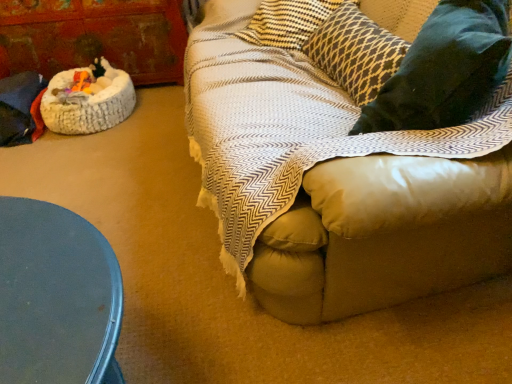
Question: From the image's perspective, relative to white fluffy cat bed at left, is velvety dark green pillow at right above or below?

Choices:
 (A) below
 (B) above

Answer: (A)

Question: Would you say velvety dark green pillow at right is inside or outside white fluffy cat bed at left?

Choices:
 (A) outside
 (B) inside

Answer: (A)

Question: Estimate the real-world distances between objects in this image. Which object is closer to the dark gray textured pillow at upper right?

Choices:
 (A) velvety dark green pillow at right
 (B) white fluffy cat bed at left
 (C) rustic wood armoire at left

Answer: (A)

Question: Which object is the farthest from the white fluffy cat bed at left?

Choices:
 (A) dark gray textured pillow at upper right
 (B) velvety dark green pillow at right
 (C) rustic wood armoire at left

Answer: (B)